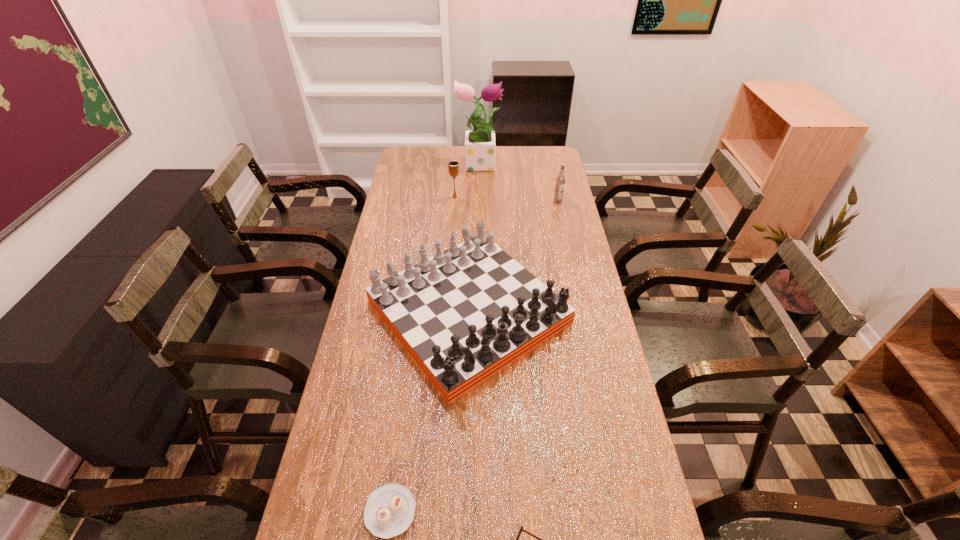
The height and width of the screenshot is (540, 960). What are the coordinates of `object located in the left edge section of the desktop` in the screenshot? It's located at (464, 314).

You are a GUI agent. You are given a task and a screenshot of the screen. Output one action in this format:
    pyautogui.click(x=<x>, y=<y>)
    Task: Click on the vodka located in the right edge section of the desktop
    The width and height of the screenshot is (960, 540).
    Given the screenshot: What is the action you would take?
    pyautogui.click(x=560, y=179)

Locate an element on the screen. The width and height of the screenshot is (960, 540). gameboard located in the right edge section of the desktop is located at coordinates (464, 314).

Where is `vacant area at the far edge of the desktop`? vacant area at the far edge of the desktop is located at coordinates (462, 153).

You are a GUI agent. You are given a task and a screenshot of the screen. Output one action in this format:
    pyautogui.click(x=<x>, y=<y>)
    Task: Click on the vacant space at the left edge of the desktop
    This screenshot has height=540, width=960.
    Given the screenshot: What is the action you would take?
    pyautogui.click(x=305, y=530)

Where is `free location at the right edge of the desktop`? This screenshot has width=960, height=540. free location at the right edge of the desktop is located at coordinates (591, 321).

What are the coordinates of `vacant space at the far left corner` in the screenshot? It's located at (419, 154).

Find the location of a particular element. vacant space at the far right corner of the desktop is located at coordinates (546, 151).

Locate an element on the screen. This screenshot has width=960, height=540. vacant area that lies between the chalice and the tallest object is located at coordinates (467, 180).

Find the location of `free space between the chalice and the tallest object`. free space between the chalice and the tallest object is located at coordinates (467, 180).